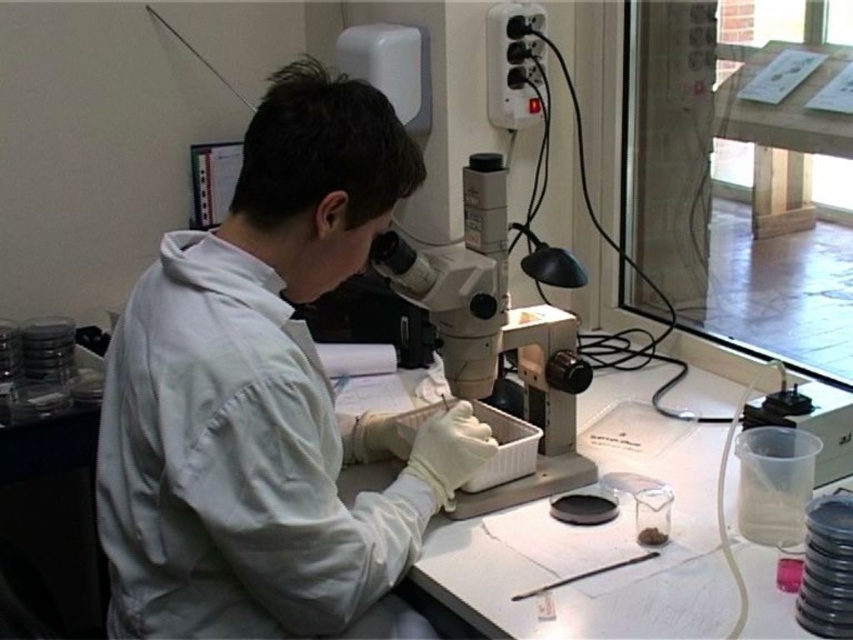
Question: Which point is farther from the camera taking this photo?

Choices:
 (A) (398, 280)
 (B) (119, 380)

Answer: (A)

Question: Which object is closer to the camera taking this photo?

Choices:
 (A) white plastic microscope at center
 (B) white matte lab coat at center

Answer: (B)

Question: Can you confirm if white matte lab coat at center is thinner than white plastic microscope at center?

Choices:
 (A) yes
 (B) no

Answer: (B)

Question: Which of the following is the closest to the observer?

Choices:
 (A) (491, 358)
 (B) (132, 308)

Answer: (B)

Question: Can you confirm if white matte lab coat at center is positioned below white plastic microscope at center?

Choices:
 (A) yes
 (B) no

Answer: (A)

Question: Does white matte lab coat at center appear under white plastic microscope at center?

Choices:
 (A) yes
 (B) no

Answer: (A)